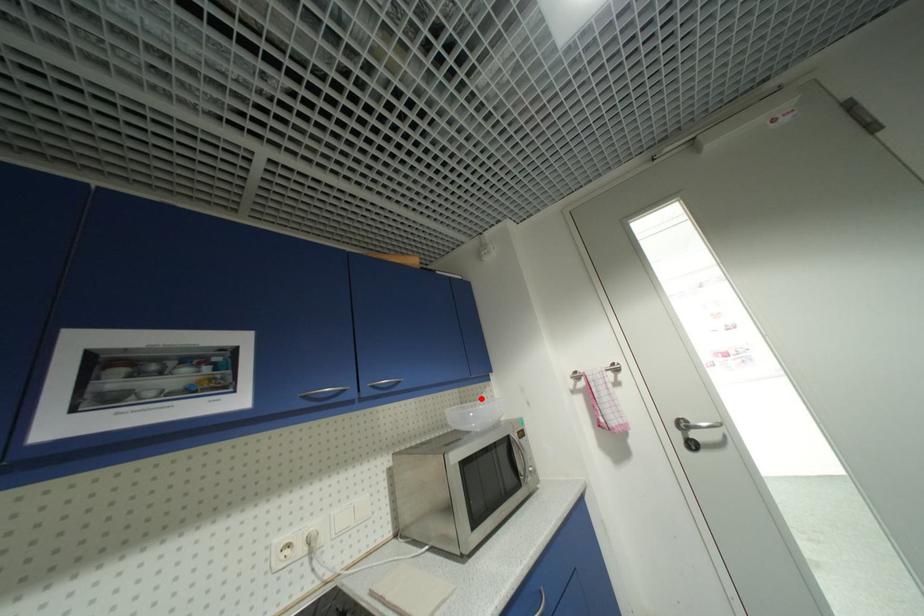
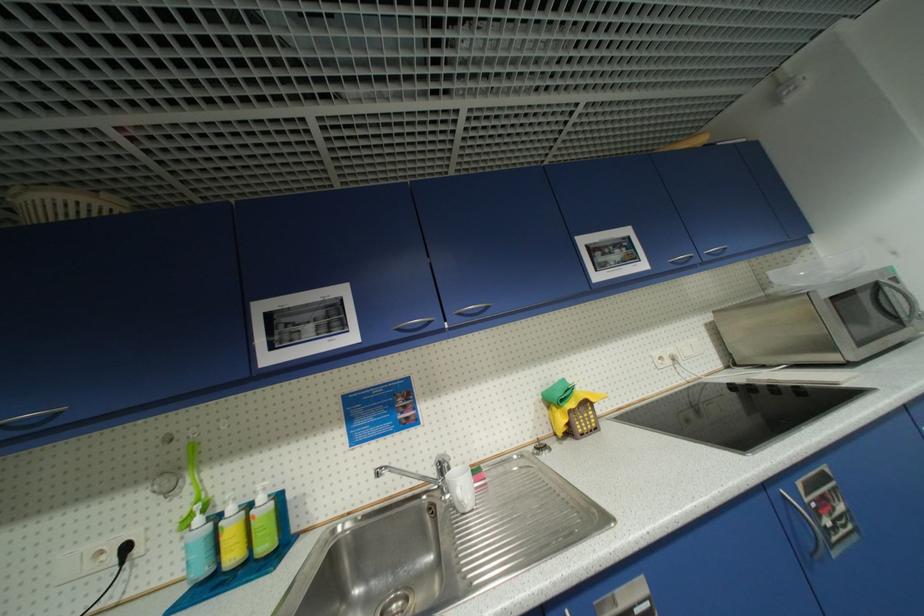
Question: A red point is marked in image1. In image2, is the corresponding 3D point closer to the camera or farther? Reply with the corresponding letter.

Choices:
 (A) The corresponding 3D point is closer.
 (B) The corresponding 3D point is farther.

Answer: (A)